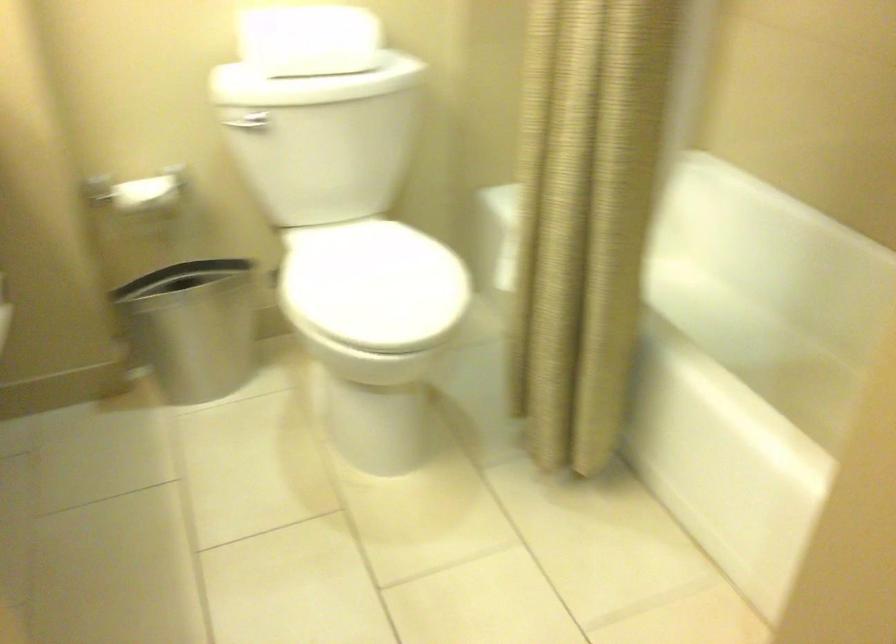
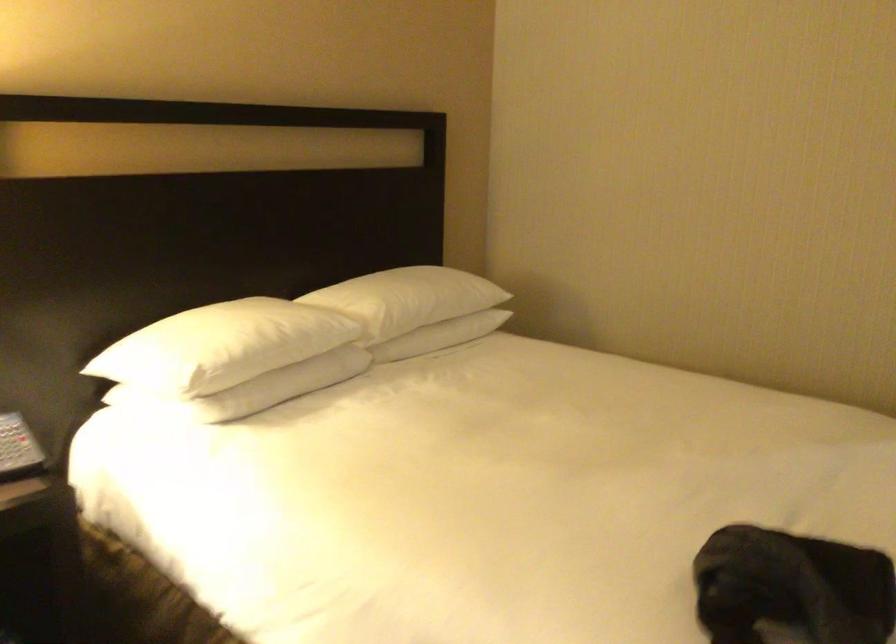
Question: I am providing you with two images of the same scene from different viewpoints. After the viewpoint changes to image2, which objects are now occluded?

Choices:
 (A) metal keyhole
 (B) telephone button
 (C) toilet paper roll
 (D) telephone handset

Answer: (C)